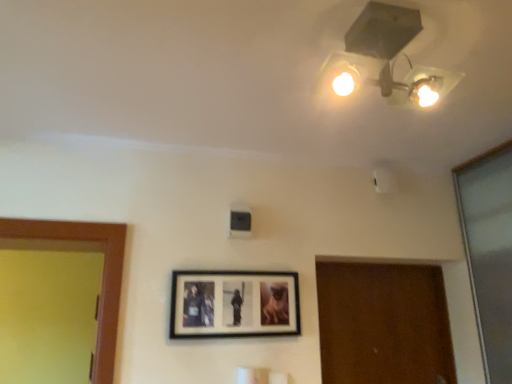
Describe the element at coordinates (234, 304) in the screenshot. I see `wooden picture frame at center` at that location.

You are a GUI agent. You are given a task and a screenshot of the screen. Output one action in this format:
    pyautogui.click(x=<x>, y=<y>)
    Task: Click on the wooden picture frame at center
    The width and height of the screenshot is (512, 384).
    Given the screenshot: What is the action you would take?
    pyautogui.click(x=234, y=304)

In order to face matte white lamp at upper center, should I rotate leftwards or rightwards?

To align with it, rotate right about 17.752°.

Image resolution: width=512 pixels, height=384 pixels. In order to click on matte white lamp at upper center in this screenshot , I will do `click(386, 58)`.

What do you see at coordinates (386, 58) in the screenshot? I see `matte white lamp at upper center` at bounding box center [386, 58].

Locate an element on the screen. wooden picture frame at center is located at coordinates (234, 304).

Consider the image. Between matte white lamp at upper center and wooden picture frame at center, which one appears on the left side from the viewer's perspective?

From the viewer's perspective, wooden picture frame at center appears more on the left side.

Considering the positions of objects matte white lamp at upper center and wooden picture frame at center in the image provided, who is in front, matte white lamp at upper center or wooden picture frame at center?

matte white lamp at upper center is closer to the camera.

Is point (364, 12) closer or farther from the camera than point (260, 274)?

Point (364, 12) is closer to the camera than point (260, 274).

From the image's perspective, is matte white lamp at upper center located beneath wooden picture frame at center?

No, from the image's perspective, matte white lamp at upper center is not beneath wooden picture frame at center.

From a real-world perspective, who is located lower, matte white lamp at upper center or wooden picture frame at center?

wooden picture frame at center.

Looking at their sizes, would you say matte white lamp at upper center is wider or thinner than wooden picture frame at center?

In the image, matte white lamp at upper center appears to be wider than wooden picture frame at center.

Considering the relative sizes of matte white lamp at upper center and wooden picture frame at center in the image provided, is matte white lamp at upper center taller than wooden picture frame at center?

No.

Who is bigger, matte white lamp at upper center or wooden picture frame at center?

Bigger between the two is matte white lamp at upper center.

Can wooden picture frame at center be found inside matte white lamp at upper center?

No, wooden picture frame at center is not a part of matte white lamp at upper center.

Does matte white lamp at upper center touch wooden picture frame at center?

They are not placed beside each other.

Does matte white lamp at upper center turn towards wooden picture frame at center?

No.

Find the location of `picture frame on the left of matte white lamp at upper center`. picture frame on the left of matte white lamp at upper center is located at coordinates (234, 304).

Based on the photo, does wooden picture frame at center appear on the left side of matte white lamp at upper center?

Indeed, wooden picture frame at center is positioned on the left side of matte white lamp at upper center.

Which object is more forward, wooden picture frame at center or matte white lamp at upper center?

matte white lamp at upper center is more forward.

Between point (287, 288) and point (404, 56), which one is positioned behind?

Point (287, 288)

From the image's perspective, which is above, wooden picture frame at center or matte white lamp at upper center?

From the image's view, matte white lamp at upper center is above.

From a real-world perspective, is wooden picture frame at center physically located above or below matte white lamp at upper center?

wooden picture frame at center is situated lower than matte white lamp at upper center in the real world.

In the scene shown: Considering the relative sizes of wooden picture frame at center and matte white lamp at upper center in the image provided, is wooden picture frame at center thinner than matte white lamp at upper center?

Yes, wooden picture frame at center is thinner than matte white lamp at upper center.

Between wooden picture frame at center and matte white lamp at upper center, which one has less height?

With less height is matte white lamp at upper center.

Is wooden picture frame at center smaller than matte white lamp at upper center?

Yes, wooden picture frame at center is smaller than matte white lamp at upper center.

Which is correct: wooden picture frame at center is inside matte white lamp at upper center, or outside of it?

wooden picture frame at center is not enclosed by matte white lamp at upper center.

Does wooden picture frame at center touch matte white lamp at upper center?

No, wooden picture frame at center is not beside matte white lamp at upper center.

Looking at this image, could you tell me if wooden picture frame at center is turned towards matte white lamp at upper center?

No, wooden picture frame at center is not oriented towards matte white lamp at upper center.

Looking at this image, can you tell me how much wooden picture frame at center and matte white lamp at upper center differ in facing direction?

wooden picture frame at center and matte white lamp at upper center are facing 2.23 degrees away from each other.

Measure the distance between wooden picture frame at center and matte white lamp at upper center.

They are 39.23 inches apart.

Locate an element on the screen. picture frame behind the matte white lamp at upper center is located at coordinates (234, 304).

This screenshot has width=512, height=384. In order to click on lamp positioned vertically above the wooden picture frame at center (from a real-world perspective) in this screenshot , I will do `click(386, 58)`.

This screenshot has height=384, width=512. Identify the location of lamp on the right of wooden picture frame at center. (386, 58).